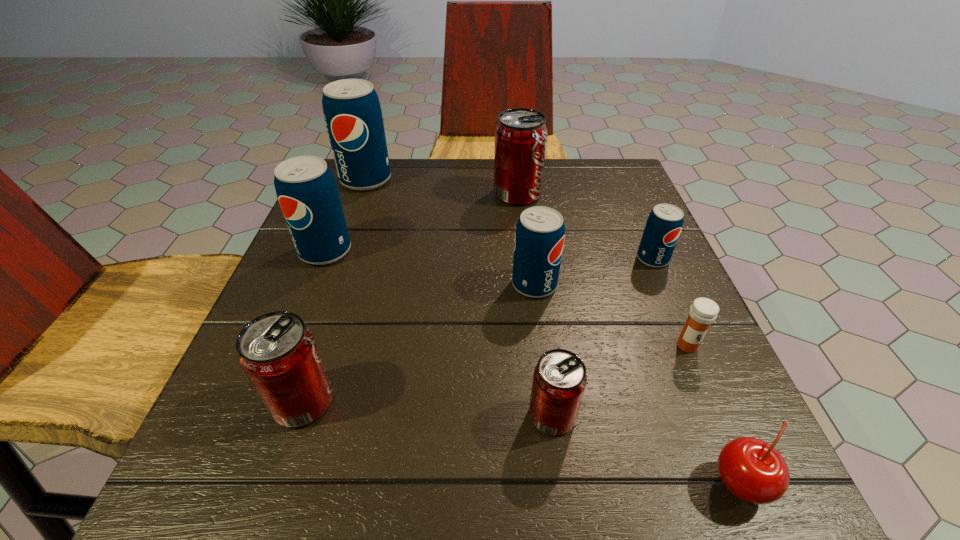
Where is `free spot between the rightmost pop soda and the third smallest blue pop`? free spot between the rightmost pop soda and the third smallest blue pop is located at coordinates (489, 255).

This screenshot has width=960, height=540. Identify the location of free space between the third biggest blue pop and the rightmost blue pop. (593, 272).

Where is `empty space between the tallest object and the nearest object`? empty space between the tallest object and the nearest object is located at coordinates (553, 332).

The image size is (960, 540). What are the coordinates of `free spot between the second biggest red pop soda and the nearest blue pop` in the screenshot? It's located at (419, 343).

The width and height of the screenshot is (960, 540). Find the location of `object that is the fourth nearest to the third smallest blue pop`. object that is the fourth nearest to the third smallest blue pop is located at coordinates coord(540,231).

Identify which object is the fourth closest to the medicine. Please provide its 2D coordinates. Your answer should be formatted as a tuple, i.e. [(x, y)], where the tuple contains the x and y coordinates of a point satisfying the conditions above.

[(559, 380)]

Image resolution: width=960 pixels, height=540 pixels. In order to click on the sixth closest pop soda to the biggest blue pop in this screenshot , I will do `click(559, 380)`.

The image size is (960, 540). Identify the location of pop soda object that ranks as the fourth closest to the biggest red pop soda. coord(306,189).

Identify which blue pop is the third nearest to the leftmost red pop soda. Please provide its 2D coordinates. Your answer should be formatted as a tuple, i.e. [(x, y)], where the tuple contains the x and y coordinates of a point satisfying the conditions above.

[(352, 112)]

At what (x,y) coordinates should I click in order to perform the action: click on blue pop that is the fourth nearest to the second biggest red pop soda. Please return your answer as a coordinate pair (x, y). The height and width of the screenshot is (540, 960). Looking at the image, I should click on (664, 224).